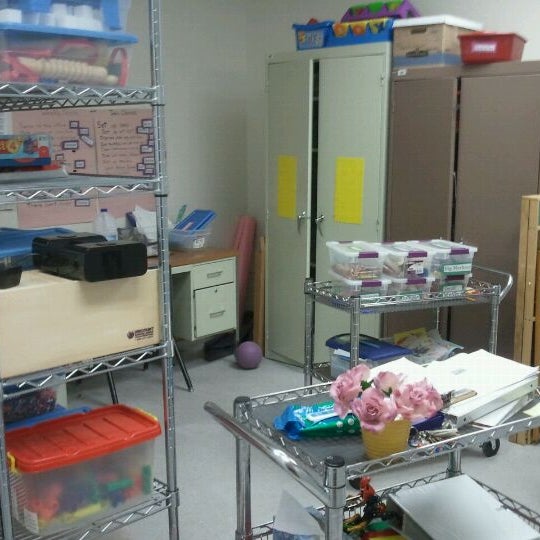
The width and height of the screenshot is (540, 540). What are the coordinates of `red bin` in the screenshot? It's located at (488, 45).